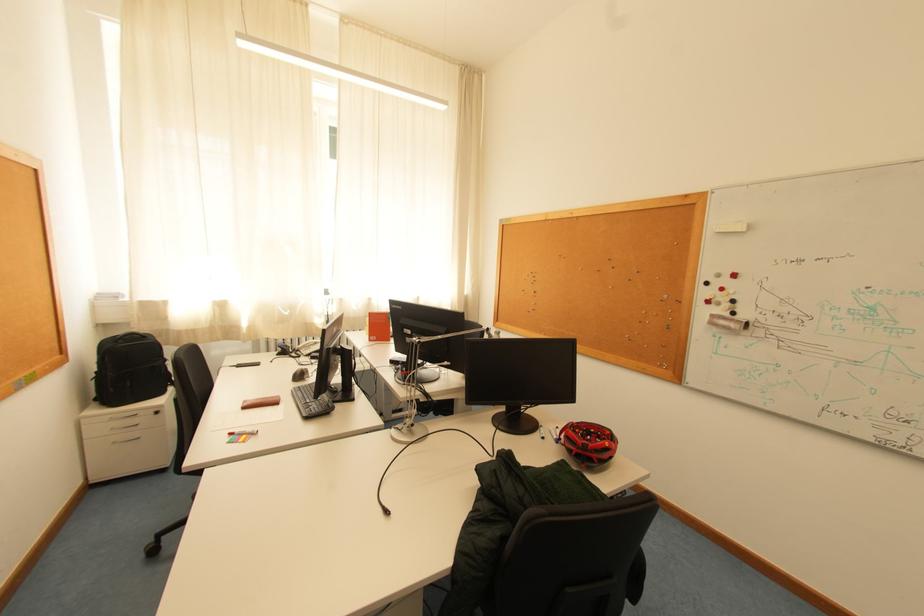
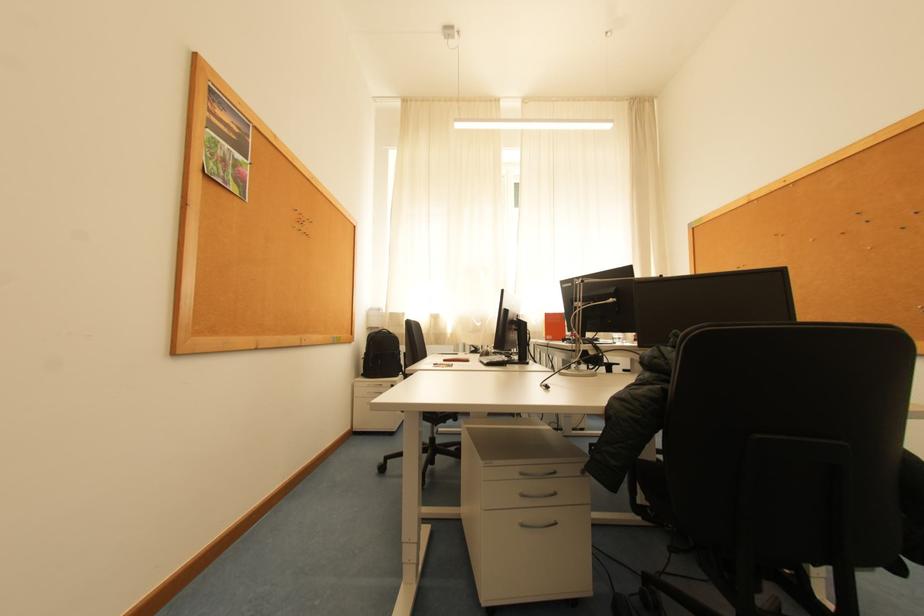
Find the pixel in the second image that matches pixel 103 371 in the first image.

(372, 353)